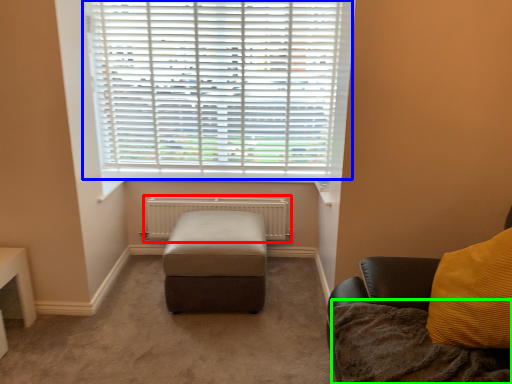
Question: Which object is the farthest from radiator (highlighted by a red box)? Choose among these: window blind (highlighted by a blue box) or blanket (highlighted by a green box).

Choices:
 (A) window blind
 (B) blanket

Answer: (B)